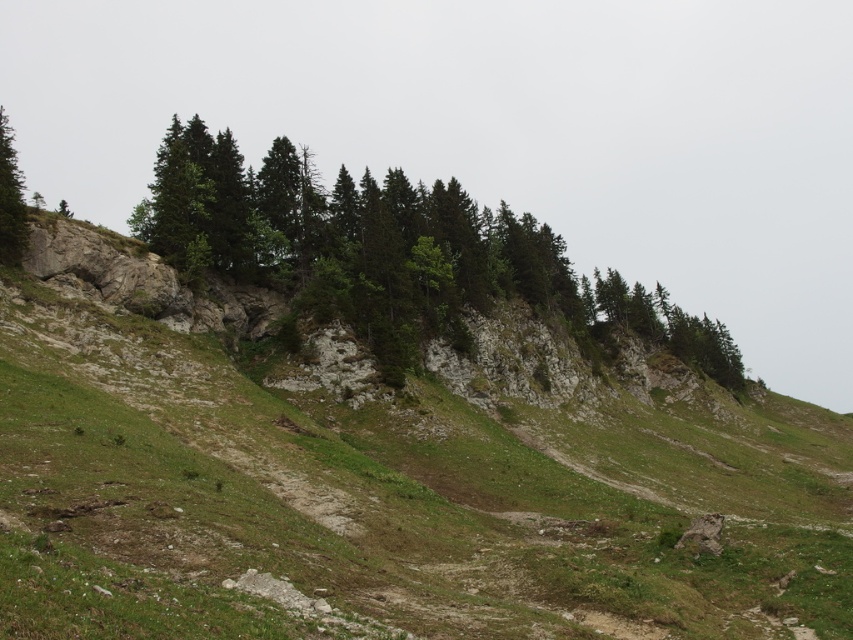
Question: Can you confirm if green grassy hillside at center is positioned above green textured trees at center?

Choices:
 (A) yes
 (B) no

Answer: (B)

Question: Which object is positioned closest to the green grassy hillside at center?

Choices:
 (A) green textured trees at center
 (B) green matte tree at left

Answer: (A)

Question: Does green grassy hillside at center appear over green matte tree at left?

Choices:
 (A) yes
 (B) no

Answer: (B)

Question: Among these points, which one is nearest to the camera?

Choices:
 (A) (15, 252)
 (B) (730, 577)
 (C) (709, 376)

Answer: (B)

Question: Which of the following is the closest to the observer?

Choices:
 (A) (4, 195)
 (B) (322, 582)
 (C) (461, 346)

Answer: (B)

Question: Does green grassy hillside at center have a greater width compared to green matte tree at left?

Choices:
 (A) no
 (B) yes

Answer: (A)